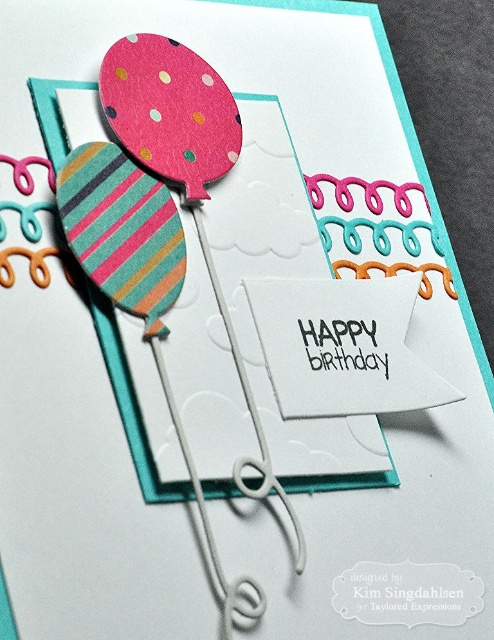
You are holding a camera 36 inches away from your face. You want to take a photo of the striped paper balloon at left so that it fills the frame perfectly. Given that the balloon is currently 37.84 inches away from the camera, should you move closer or farther away?

The striped paper balloon at left is currently 37.84 inches away from the camera. Since you want the balloon to fill the frame perfectly and you are holding the camera 36 inches away from your face, you need to move closer to reduce the distance to 36 inches. However, the balloon is already 37.84 inches away, which is farther than 36 inches. To fill the frame, you should move closer to decrease the distance between the camera and the balloon.

You are designing a birthday card and want to place a sticker below both the striped paper balloon at left and the polka dot paper balloon at upper left. Based on their heights, where should you place the sticker so it is below both?

The striped paper balloon at left is much taller than the polka dot paper balloon at upper left. To place the sticker below both, position it below the base of the striped paper balloon at left since it is the taller one.

You are designing a birthday card and want to add a new decorative element between the striped paper balloon at left and the polka dot paper balloon at upper left. Based on their positions, where should you place the new element to ensure it is centered between them?

The striped paper balloon at left is positioned on the left side of polka dot paper balloon at upper left, so placing the new decorative element between them would require positioning it to the right of the striped paper balloon at left and to the left of the polka dot paper balloon at upper left to center it between both balloons.